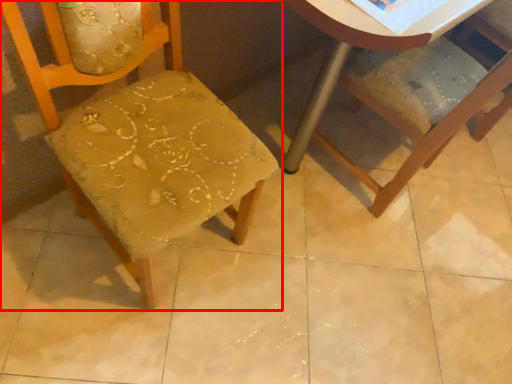
Question: Considering the relative positions of chair (annotated by the red box) and chair in the image provided, where is chair (annotated by the red box) located with respect to the staircase?

Choices:
 (A) right
 (B) left

Answer: (B)